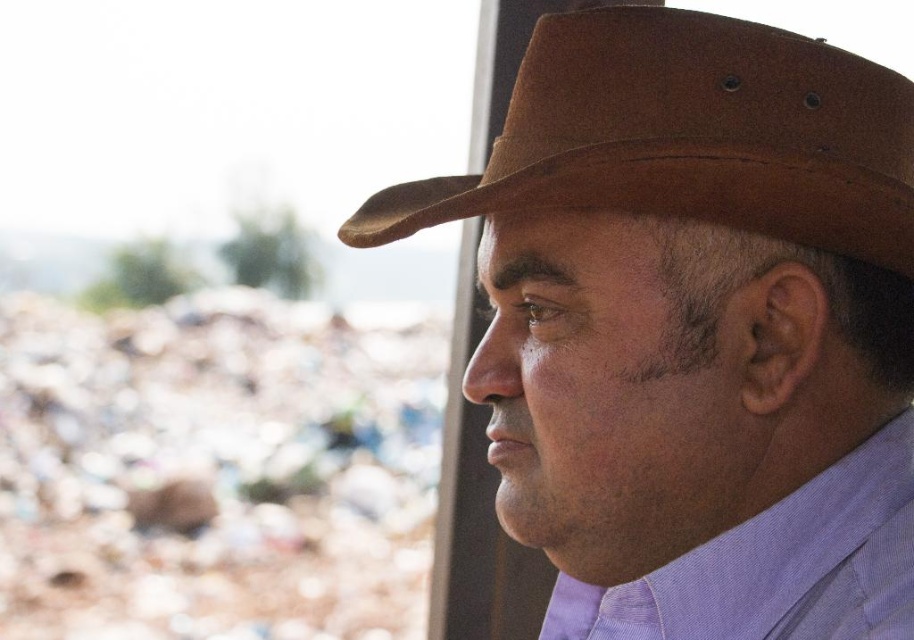
You are a photographer trying to capture a closeup of the brown leather hat at upper right and the brown suede cowboy hat at upper center. Since you want both hats to be in focus, what should you consider about their distance?

The brown leather hat at upper right is only 1.50 inches away from the brown suede cowboy hat at upper center, so you can set a small aperture to ensure both are in focus.

In the scene shown: You are a photographer trying to capture the man in the image. The brown suede cowboy hat at upper center is represented by point (688, 134). Where should you position your camera to ensure the hat is centered in the frame?

To center the brown suede cowboy hat at upper center represented by point (688, 134), position your camera so that the frame is aligned with the coordinates provided, ensuring the hat is at the center of the image.

You are an interior designer assessing the spatial arrangement of a room. You notice the brown leather hat at upper right and the brown suede cowboy hat at upper center. Which hat is positioned higher in the image?

The brown leather hat at upper right has a greater height compared to the brown suede cowboy hat at upper center, so the brown leather hat at upper right is positioned higher in the image.